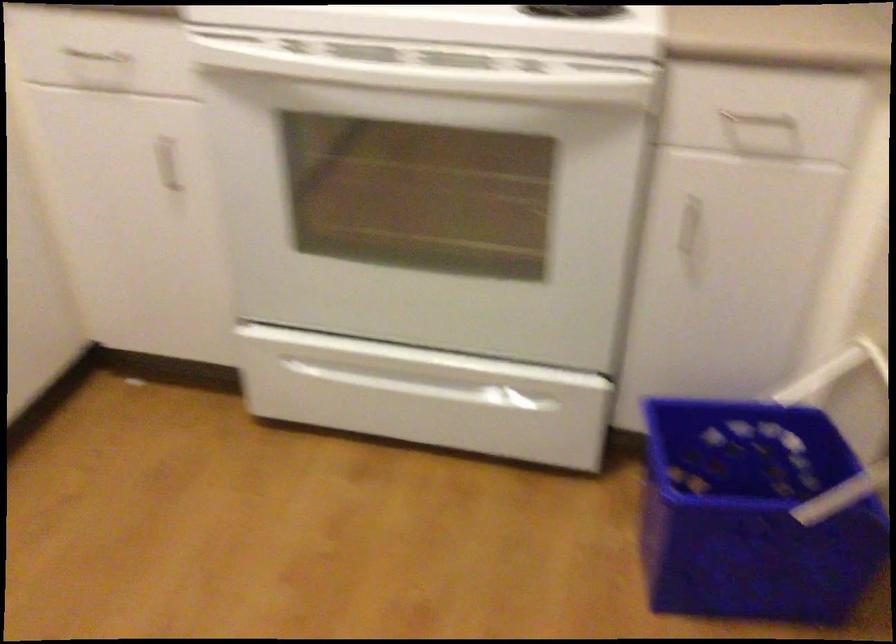
Identify the location of oven door handle. This screenshot has width=896, height=644. (437, 77).